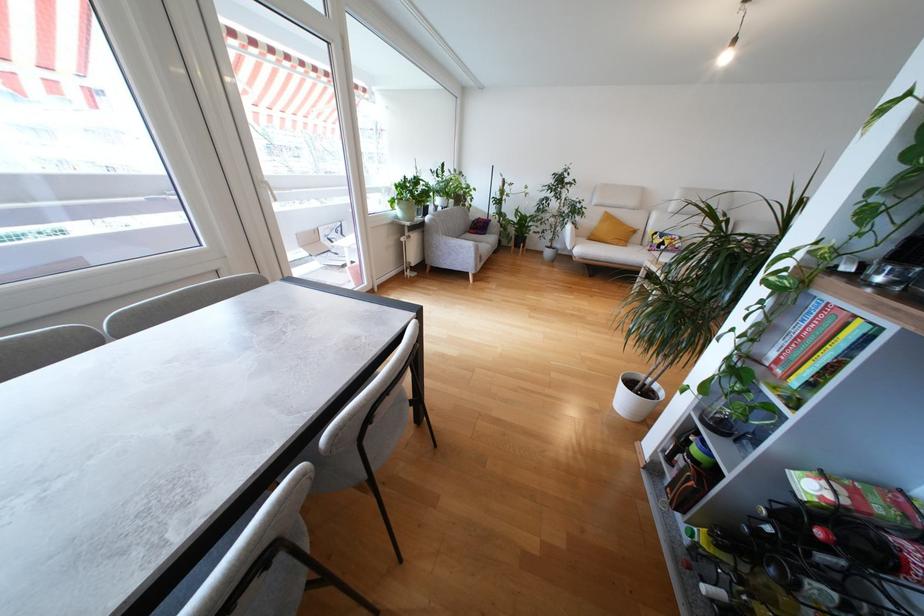
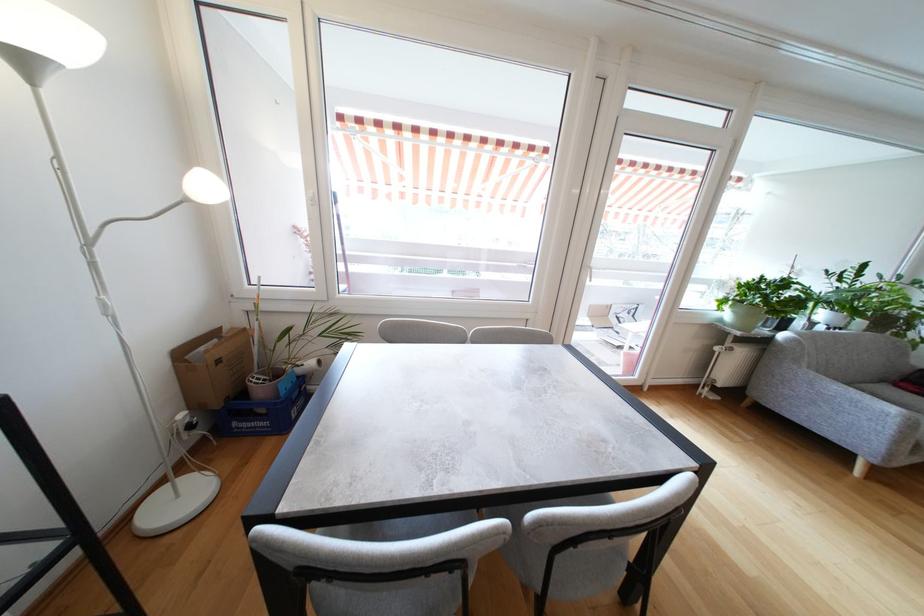
In the second image, find the point that corresponds to point (407, 245) in the first image.

(721, 355)